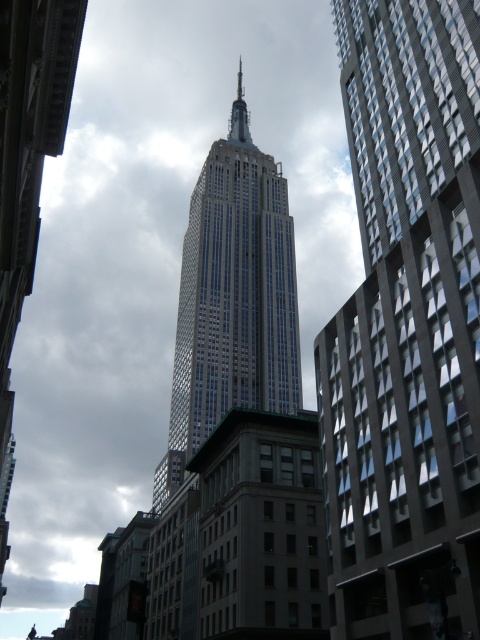
Based on the photo, you are a drone operator trying to deliver a package to the Empire State Building. Your GPS shows a point at coordinates [406,330]. Which building should you avoid to ensure you deliver the package correctly?

The point at coordinates [406,330] corresponds to the gray glass skyscraper at right, so you should avoid that building and head towards the Empire State Building instead.

You are an architect analyzing the skyline of New York City. You notice the gray glass skyscraper at right and the glassy steel tower at center. Which one has a greater height?

The glassy steel tower at center is taller than the gray glass skyscraper at right.